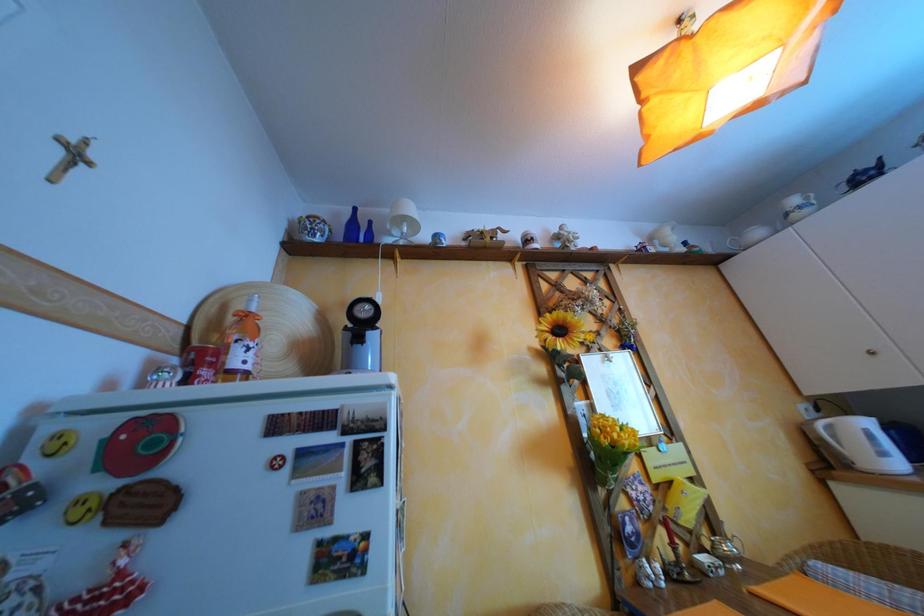
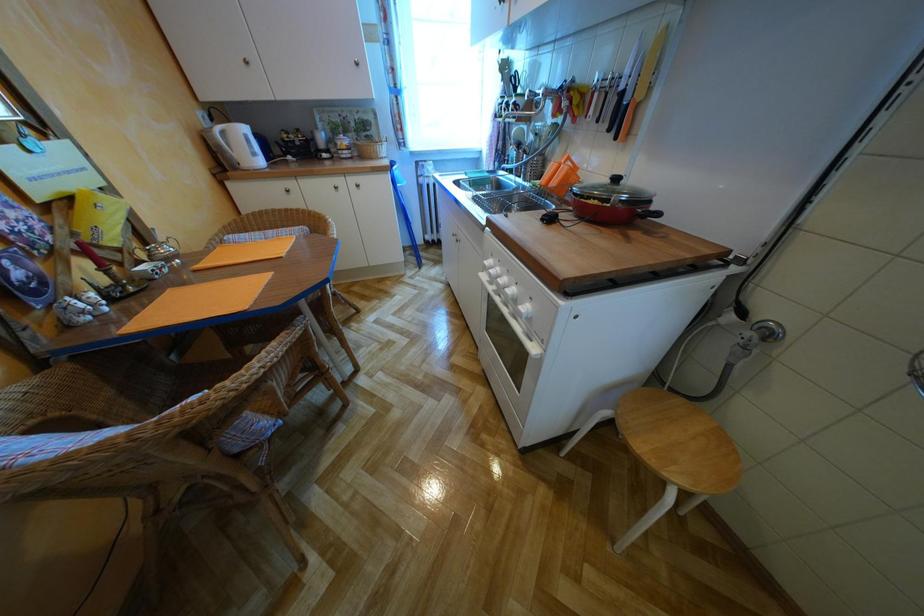
The images are taken continuously from a first-person perspective. In which direction is your viewpoint rotating?

The rotation direction of the camera is right-down.